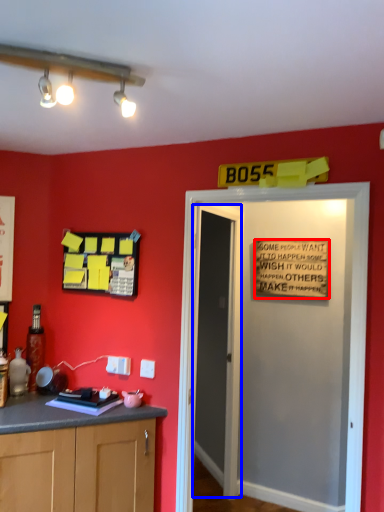
Question: Which object is closer to the camera taking this photo, warning sign (highlighted by a red box) or door (highlighted by a blue box)?

Choices:
 (A) warning sign
 (B) door

Answer: (B)